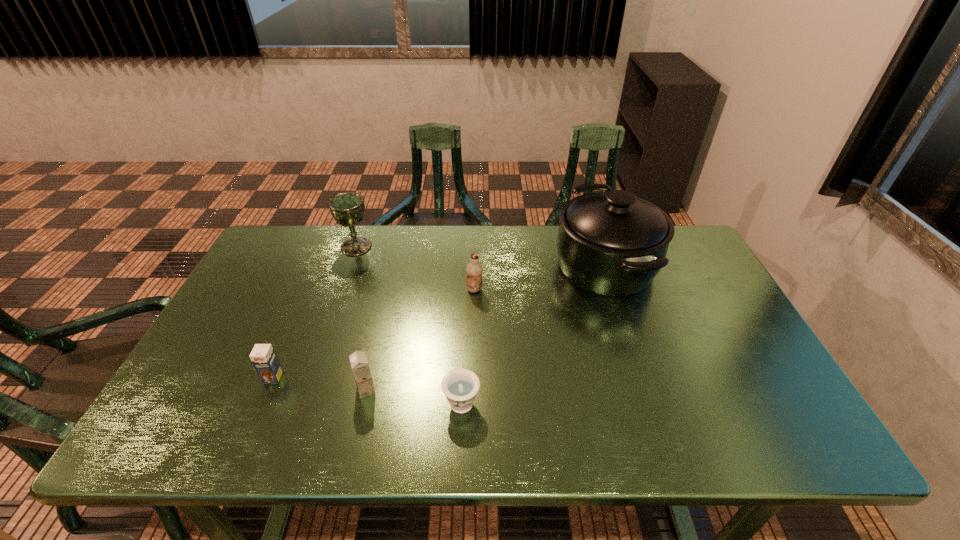
At what (x,y) coordinates should I click in order to perform the action: click on vacant area in the image that satisfies the following two spatial constraints: 1. on the front label of the leftmost object; 2. on the left side of the third object from left to right. Please return your answer as a coordinate pair (x, y). The height and width of the screenshot is (540, 960). Looking at the image, I should click on (269, 389).

Find the location of a particular element. free space that satisfies the following two spatial constraints: 1. on the back side of the saucepan; 2. on the left side of the farthest chocolate milk is located at coordinates (475, 265).

The image size is (960, 540). I want to click on free space that satisfies the following two spatial constraints: 1. on the front label of the leftmost object; 2. on the right side of the second chocolate milk from right to left, so click(x=269, y=389).

Identify the location of free spot that satisfies the following two spatial constraints: 1. on the front side of the farthest chocolate milk; 2. on the right side of the second tallest object. (341, 290).